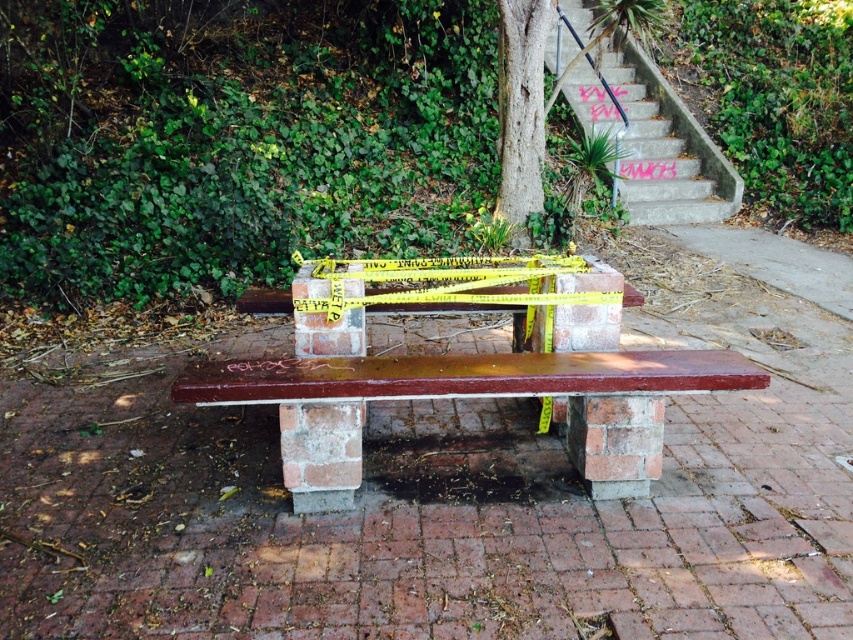
Question: Which object appears closest to the camera in this image?

Choices:
 (A) concrete stairs at upper right
 (B) smooth bark tree at center
 (C) brick pavement at center

Answer: (C)

Question: Is brick pavement at center positioned before matte brown bench at center?

Choices:
 (A) no
 (B) yes

Answer: (B)

Question: Which object is farther from the camera taking this photo?

Choices:
 (A) concrete stairs at upper right
 (B) matte brown bench at center

Answer: (A)

Question: Can you confirm if brick pavement at center is thinner than matte brown bench at center?

Choices:
 (A) yes
 (B) no

Answer: (B)

Question: Which point is farther from the camera taking this photo?

Choices:
 (A) (660, 113)
 (B) (798, 449)

Answer: (A)

Question: Does brick pavement at center appear over smooth bark tree at center?

Choices:
 (A) yes
 (B) no

Answer: (B)